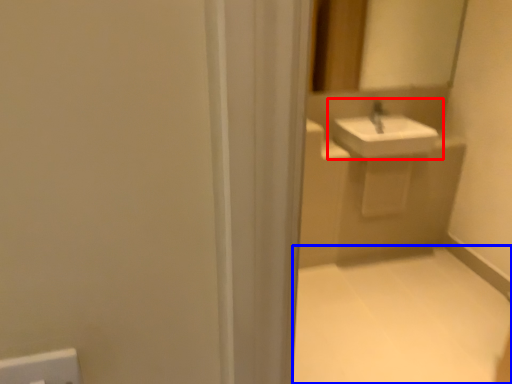
Question: Which of the following is the closest to the observer, sink (highlighted by a red box) or plain (highlighted by a blue box)?

Choices:
 (A) sink
 (B) plain

Answer: (B)